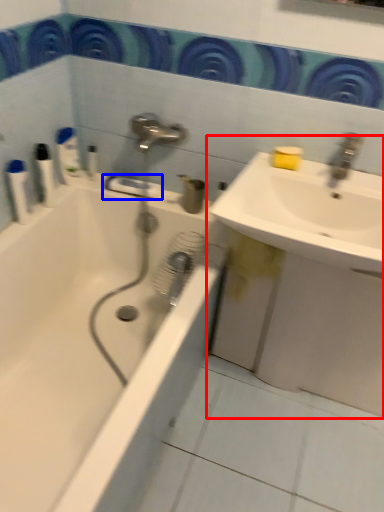
Question: Which of the following is the farthest to the observer, sink (highlighted by a red box) or towel bar (highlighted by a blue box)?

Choices:
 (A) sink
 (B) towel bar

Answer: (B)